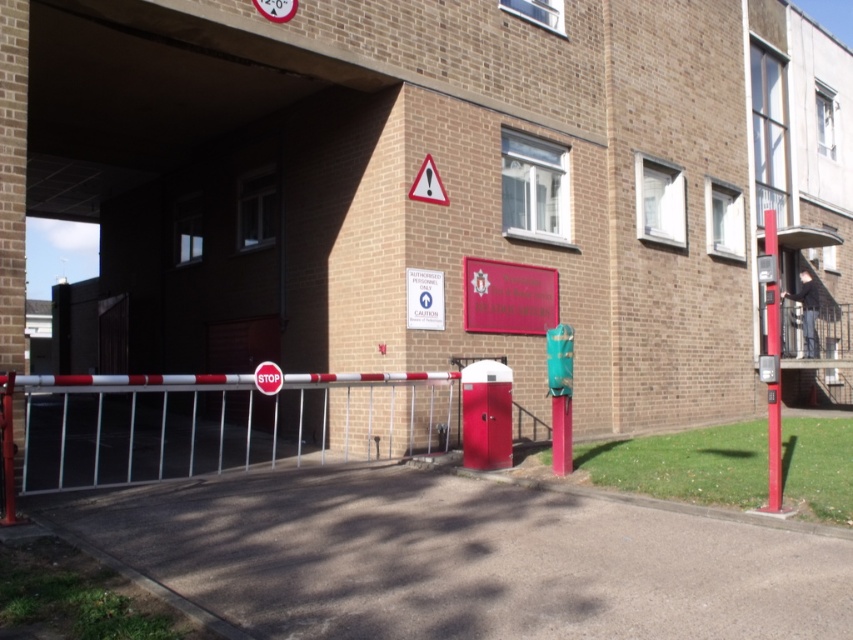
You are a delivery driver approaching the entrance of the fire station. You need to park your vehicle between the metallic red pole at right and the white paper sign at center. Is this possible given their positions?

The metallic red pole at right is to the right of the white paper sign at center, so there is space between them where you can park your vehicle.